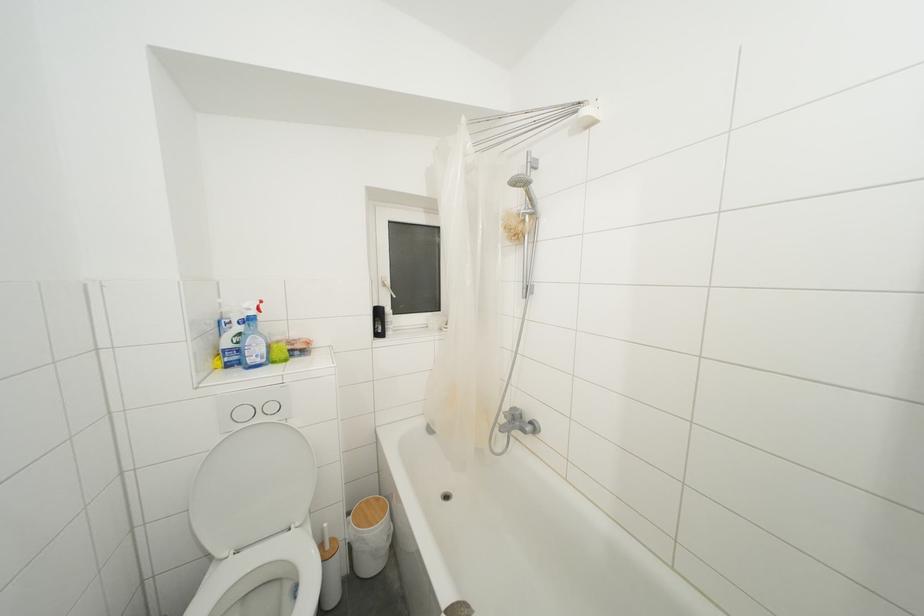
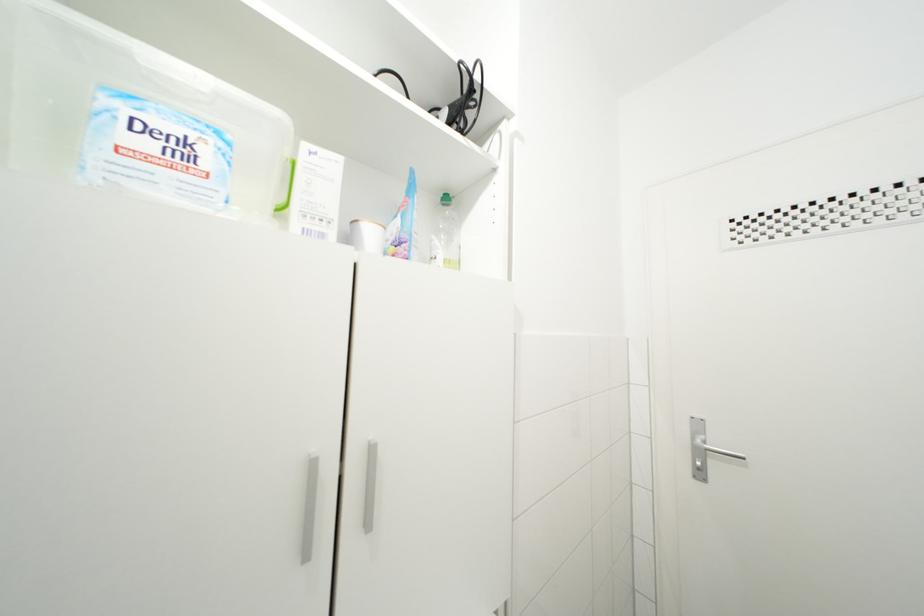
Question: The first image is from the beginning of the video and the second image is from the end. How did the camera likely rotate when shooting the video?

Choices:
 (A) Left
 (B) Right
 (C) Up
 (D) Down

Answer: (B)